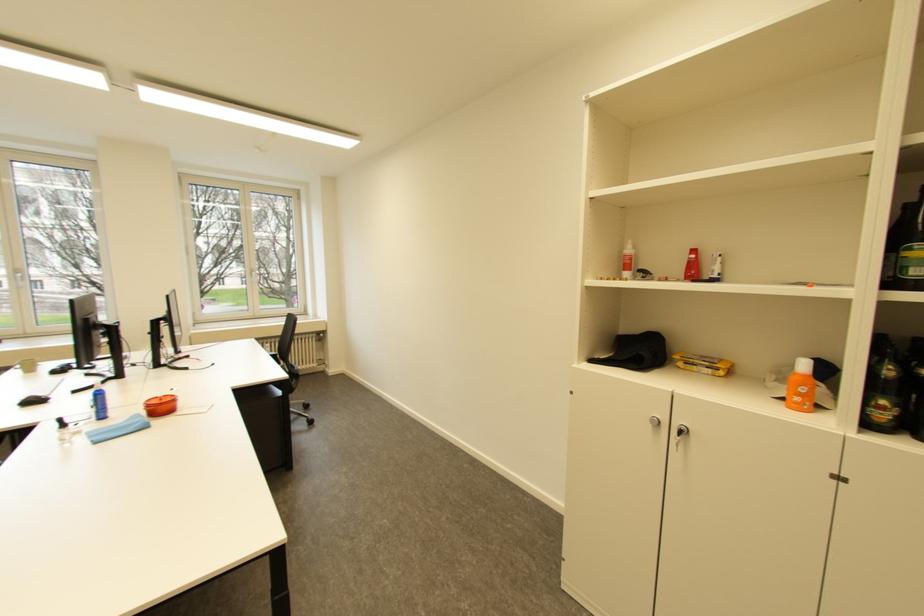
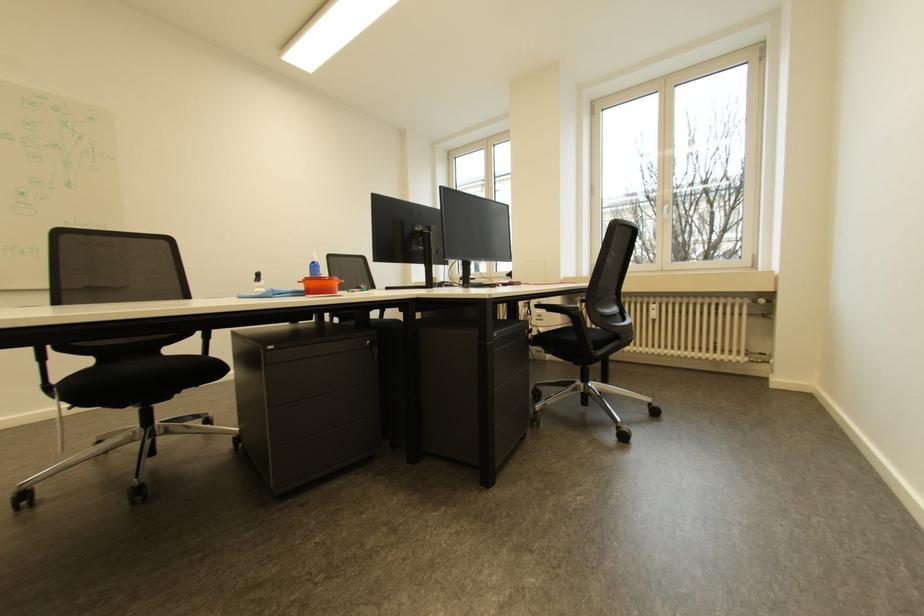
Locate, in the second image, the point that corresponds to (x=261, y=275) in the first image.

(672, 209)